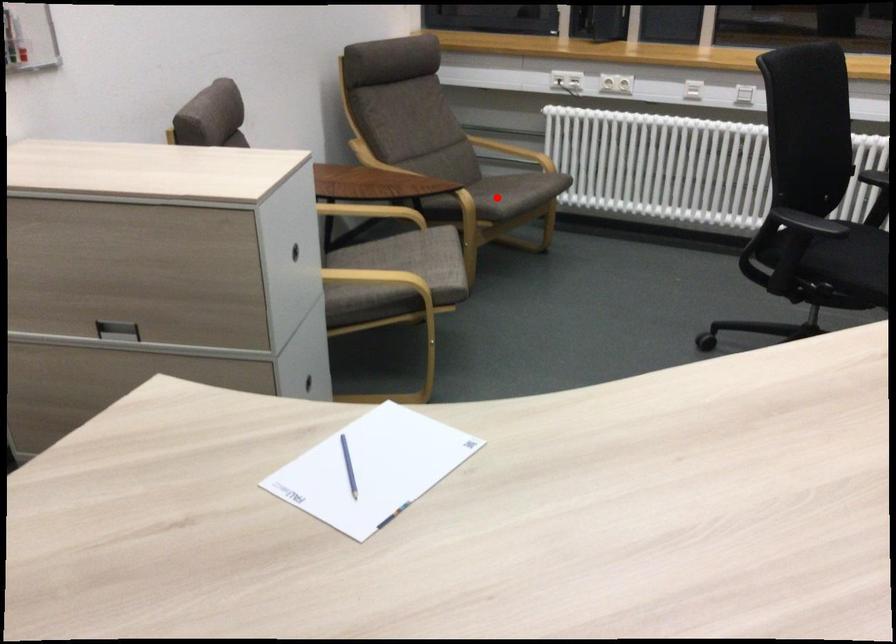
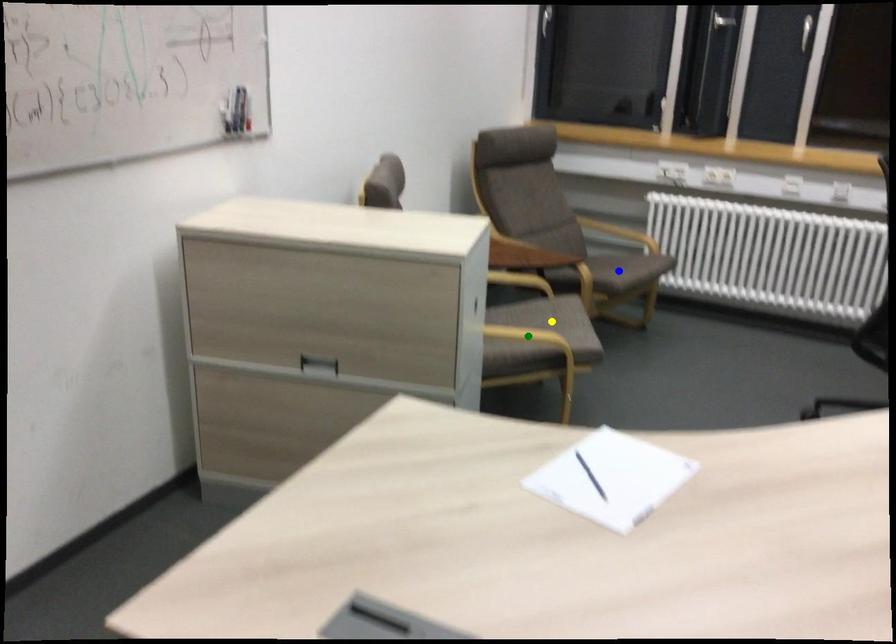
Question: I am providing you with two images of the same scene from different viewpoints. A red point is marked on the first image. You are given multiple points on the second image. Which point in image 2 is actually the same real-world point as the red point in image 1?

Choices:
 (A) yellow point
 (B) green point
 (C) blue point

Answer: (C)